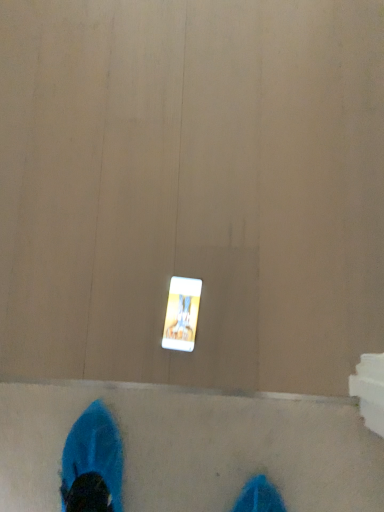
This screenshot has height=512, width=384. Find the location of `vacant area on the back side of white glossy mobile phone at center`. vacant area on the back side of white glossy mobile phone at center is located at coordinates (153, 248).